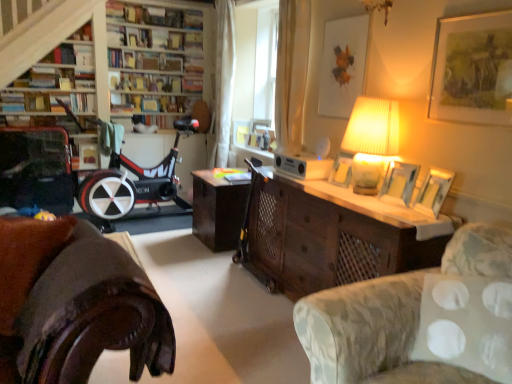
Question: In terms of size, does matte white picture frame at upper center, the 1th picture frame viewed from the back, appear bigger or smaller than hardcover book at center, the 2th book from the back?

Choices:
 (A) small
 (B) big

Answer: (A)

Question: From their relative heights in the image, would you say matte white picture frame at upper center, which is the 5th picture frame from front to back, is taller or shorter than hardcover book at center, the 2th book from the back?

Choices:
 (A) tall
 (B) short

Answer: (A)

Question: Based on their relative distances, which object is farther from the wooden picture frame at right, arranged as the fourth picture frame when viewed from the back?

Choices:
 (A) wooden picture frame at right, the third picture frame when ordered from front to back
 (B) hardcover book at upper left, the first book in the front-to-back sequence
 (C) matte black book at upper center, the fifth book viewed from the front
 (D) hardcover book at upper left, positioned as the 4th book in back-to-front order
 (E) gold-framed artwork at upper right, the 1th picture frame when ordered from front to back

Answer: (B)

Question: Which is farther from the wooden bookshelf at upper left?

Choices:
 (A) hardcover book at center, which is the fourth book from front to back
 (B) matte white picture frame at upper center, the 1th picture frame viewed from the back
 (C) wooden desk at center
 (D) brown leather couch at lower left, acting as the first studio couch starting from the left
 (E) white sheer curtain at upper center

Answer: (C)